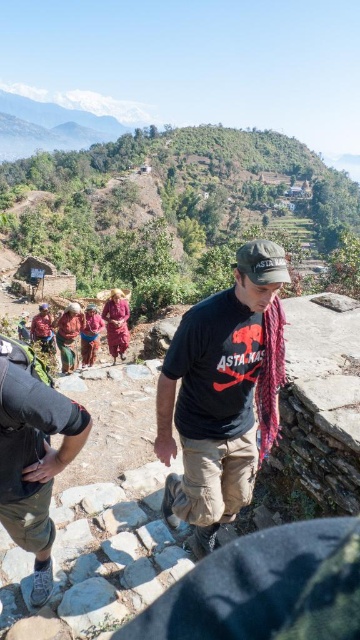
You are standing at the bottom of the mountain path and see the matte khaki shorts at lower left and the matte red scarf at lower left. Which object is positioned more to the right side?

The matte khaki shorts at lower left is positioned more to the right side than the matte red scarf at lower left.